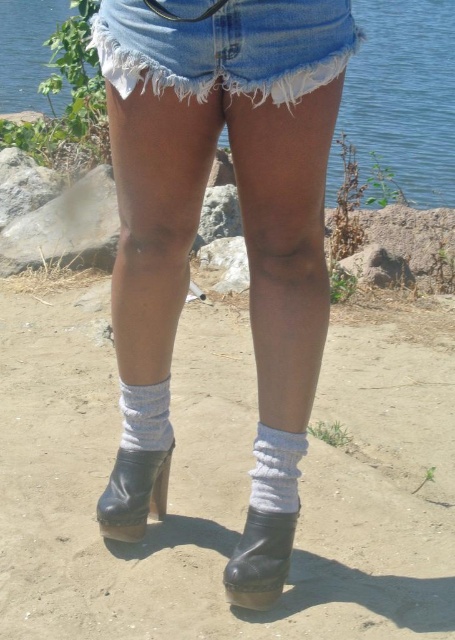
You are a fashion designer analyzing the outfit of a person standing near a lakeside. You need to determine if the distance between the white cotton socks at center and the black leather boot at lower center is sufficient for placing a decorative belt between them. The belt is 20 inches long. Can the belt fit in the space between them?

The distance between the white cotton socks at center and the black leather boot at lower center is 24.79 inches. Since the belt is 20 inches long, it can fit in the space between them as the available space is larger than the belt length.

You are standing 1.5 meters away from a black leather boot at lower center. Can you reach it without moving your feet?

The black leather boot at lower center is 1.64 meters from the viewer, which is farther than your current distance of 1.5 meters. Therefore, you cannot reach it without moving your feet.

You are standing in the scene and want to place a small pebble between the white cotton socks at center and the black leather boot at lower center. Based on their positions, which object should you place the pebble closer to if you want it to be nearer to the boot?

Since the white cotton socks at center are to the left of the black leather boot at lower center, placing the pebble closer to the boot would mean positioning it near the right side between them.